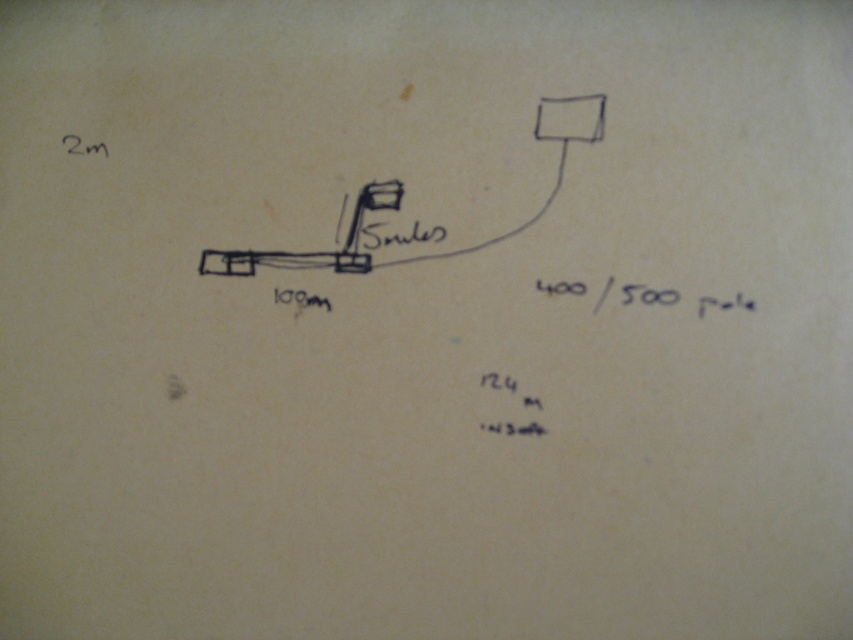
You are looking at a hand drawn diagram on paper. You see two points labeled as point (494, 372) and point (310, 300). Which point is closer to you?

Point (494, 372) is closer to the viewer than point (310, 300).